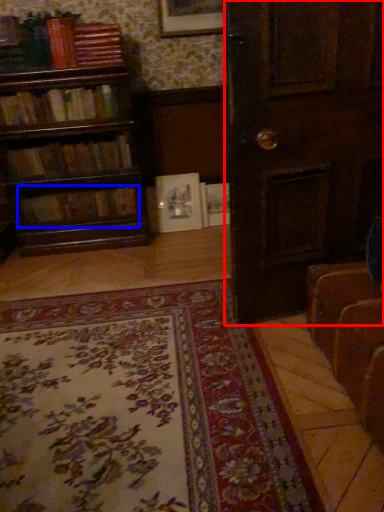
Question: Which of the following is the closest to the observer, door (highlighted by a red box) or book (highlighted by a blue box)?

Choices:
 (A) door
 (B) book

Answer: (A)